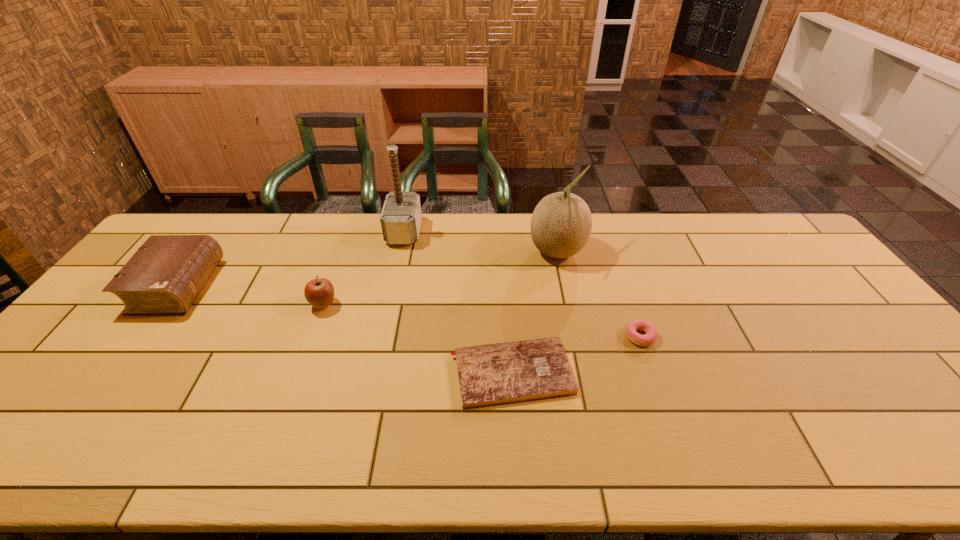
Where is `vacant space located for striking with the head of the hammer`? vacant space located for striking with the head of the hammer is located at coordinates (498, 232).

Locate an element on the screen. This screenshot has height=540, width=960. vacant space located 0.090m on the left of the second tallest object is located at coordinates (501, 253).

Where is `vacant position located on the spine side of the farther Bible`? Image resolution: width=960 pixels, height=540 pixels. vacant position located on the spine side of the farther Bible is located at coordinates (324, 286).

Where is `free space located on the back of the second object from left to right`? The width and height of the screenshot is (960, 540). free space located on the back of the second object from left to right is located at coordinates (351, 230).

Image resolution: width=960 pixels, height=540 pixels. In order to click on vacant space located 0.290m on the front of the rightmost object in this screenshot , I will do `click(682, 455)`.

Find the location of a particular element. The image size is (960, 540). free spot located on the left of the shortest object is located at coordinates (318, 373).

Locate an element on the screen. This screenshot has height=540, width=960. hammer that is at the far edge is located at coordinates (401, 216).

Locate an element on the screen. The image size is (960, 540). cantaloup that is at the far edge is located at coordinates (561, 224).

Where is `object located at the left edge`? object located at the left edge is located at coordinates (166, 274).

I want to click on blank space at the far edge, so click(464, 252).